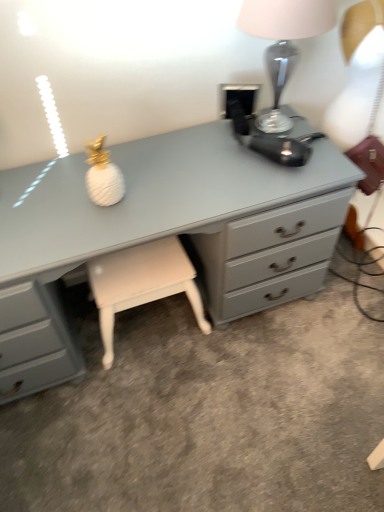
Question: Does white leather stool at center have a smaller size compared to matte gray chest of drawers at center?

Choices:
 (A) no
 (B) yes

Answer: (B)

Question: Does white leather stool at center appear on the right side of matte gray chest of drawers at center?

Choices:
 (A) yes
 (B) no

Answer: (B)

Question: Considering the relative sizes of white leather stool at center and matte gray chest of drawers at center in the image provided, is white leather stool at center shorter than matte gray chest of drawers at center?

Choices:
 (A) no
 (B) yes

Answer: (B)

Question: Is white leather stool at center located outside matte gray chest of drawers at center?

Choices:
 (A) yes
 (B) no

Answer: (B)

Question: Is white leather stool at center at the left side of matte gray chest of drawers at center?

Choices:
 (A) no
 (B) yes

Answer: (B)

Question: Can you confirm if white leather stool at center is taller than matte gray chest of drawers at center?

Choices:
 (A) no
 (B) yes

Answer: (A)

Question: Can you confirm if white leather stool at center is positioned to the right of satin silver lamp at upper right?

Choices:
 (A) yes
 (B) no

Answer: (B)

Question: Is white leather stool at center in contact with satin silver lamp at upper right?

Choices:
 (A) no
 (B) yes

Answer: (A)

Question: Is white leather stool at center behind satin silver lamp at upper right?

Choices:
 (A) no
 (B) yes

Answer: (B)

Question: From the image's perspective, is white leather stool at center above satin silver lamp at upper right?

Choices:
 (A) yes
 (B) no

Answer: (B)

Question: Considering the relative positions of white leather stool at center and satin silver lamp at upper right in the image provided, is white leather stool at center to the left of satin silver lamp at upper right from the viewer's perspective?

Choices:
 (A) yes
 (B) no

Answer: (A)

Question: Considering the relative sizes of white leather stool at center and satin silver lamp at upper right in the image provided, is white leather stool at center smaller than satin silver lamp at upper right?

Choices:
 (A) no
 (B) yes

Answer: (A)

Question: From the image's perspective, is matte gray chest of drawers at center beneath white leather stool at center?

Choices:
 (A) no
 (B) yes

Answer: (A)